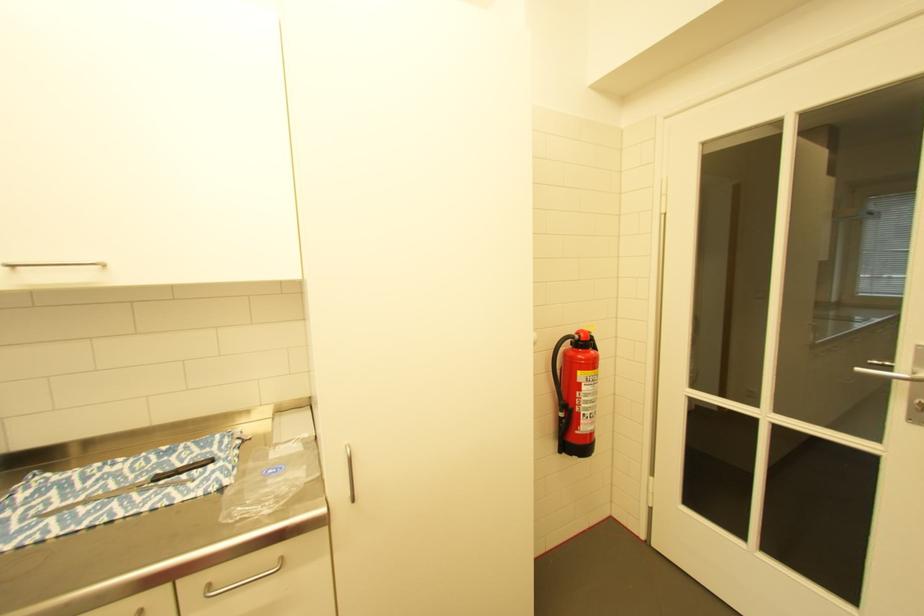
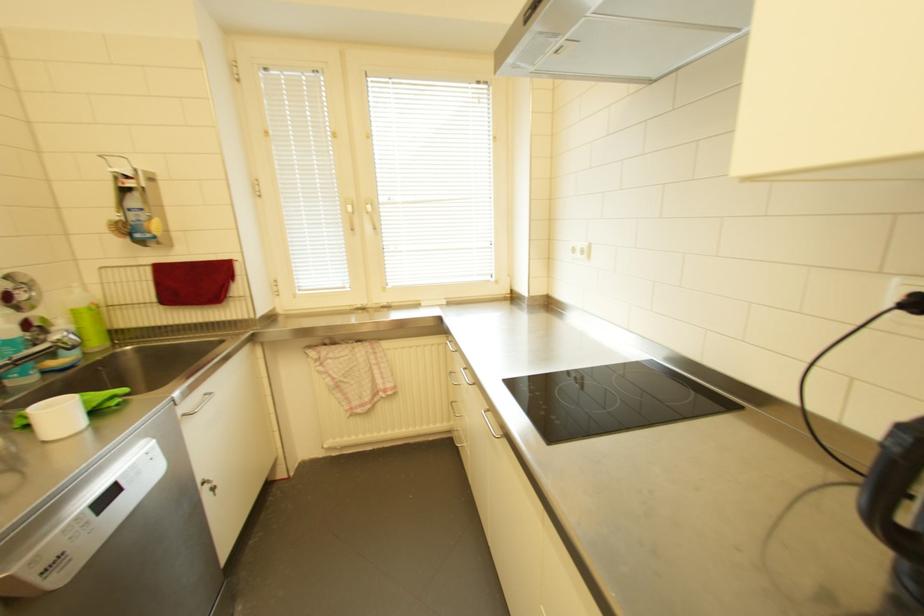
Based on the photo, the images are taken continuously from a first-person perspective. In which direction is your viewpoint rotating?

The rotation direction of the camera is left-down.